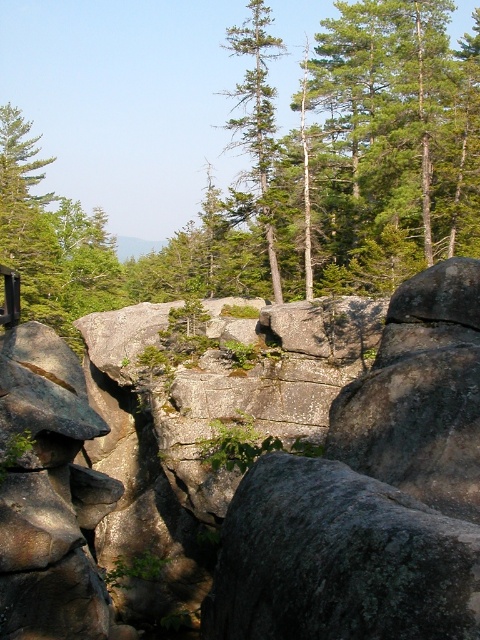
Question: Does green matte tree at upper left have a larger size compared to green matte tree at upper center?

Choices:
 (A) no
 (B) yes

Answer: (B)

Question: Which of the following is the closest to the observer?

Choices:
 (A) green matte tree at upper left
 (B) green matte tree at upper center

Answer: (A)

Question: Is green matte tree at upper left further to the viewer compared to green matte tree at upper center?

Choices:
 (A) no
 (B) yes

Answer: (A)

Question: Which of the following is the farthest from the observer?

Choices:
 (A) green matte tree at upper left
 (B) green matte tree at upper center

Answer: (B)

Question: Is green matte tree at upper left wider than green matte tree at upper center?

Choices:
 (A) no
 (B) yes

Answer: (B)